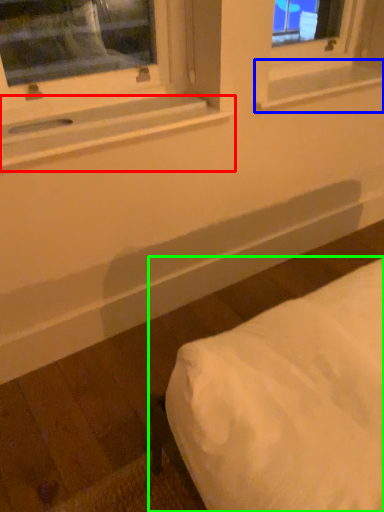
Question: Which object is positioned closest to window sill (highlighted by a red box)? Select from window sill (highlighted by a blue box) and furniture (highlighted by a green box).

Choices:
 (A) window sill
 (B) furniture

Answer: (A)